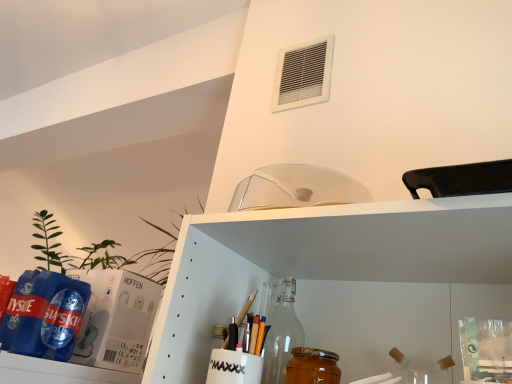
What do you see at coordinates (312, 367) in the screenshot? The image size is (512, 384). I see `golden honey jar at lower center` at bounding box center [312, 367].

Image resolution: width=512 pixels, height=384 pixels. Find the location of `golden honey jar at lower center`. golden honey jar at lower center is located at coordinates (312, 367).

Identify the location of white plastic air conditioning at upper center. (303, 75).

This screenshot has width=512, height=384. What do you see at coordinates (303, 75) in the screenshot?
I see `white plastic air conditioning at upper center` at bounding box center [303, 75].

Identify the location of golden honey jar at lower center. Image resolution: width=512 pixels, height=384 pixels. (312, 367).

Does golden honey jar at lower center appear on the right side of white plastic air conditioning at upper center?

In fact, golden honey jar at lower center is to the left of white plastic air conditioning at upper center.

Which is in front, golden honey jar at lower center or white plastic air conditioning at upper center?

golden honey jar at lower center is in front.

Considering the positions of points (302, 377) and (297, 59), is point (302, 377) farther from camera compared to point (297, 59)?

No, it is in front of (297, 59).

From the image's perspective, is golden honey jar at lower center beneath white plastic air conditioning at upper center?

Yes, from the image's perspective, golden honey jar at lower center is below white plastic air conditioning at upper center.

From a real-world perspective, is golden honey jar at lower center on white plastic air conditioning at upper center?

Incorrect, from a real-world perspective, golden honey jar at lower center is lower than white plastic air conditioning at upper center.

Considering the sizes of golden honey jar at lower center and white plastic air conditioning at upper center in the image, is golden honey jar at lower center wider or thinner than white plastic air conditioning at upper center?

golden honey jar at lower center is wider than white plastic air conditioning at upper center.

Does golden honey jar at lower center have a greater height compared to white plastic air conditioning at upper center?

No, golden honey jar at lower center is not taller than white plastic air conditioning at upper center.

Considering the relative sizes of golden honey jar at lower center and white plastic air conditioning at upper center in the image provided, is golden honey jar at lower center bigger than white plastic air conditioning at upper center?

No.

In the scene shown: Would you say golden honey jar at lower center is inside or outside white plastic air conditioning at upper center?

golden honey jar at lower center is outside white plastic air conditioning at upper center.

Is golden honey jar at lower center beside white plastic air conditioning at upper center?

golden honey jar at lower center and white plastic air conditioning at upper center are clearly separated.

Is golden honey jar at lower center oriented away from white plastic air conditioning at upper center?

No, golden honey jar at lower center is not facing away from white plastic air conditioning at upper center.

Where is `air conditioning located behind the golden honey jar at lower center`? air conditioning located behind the golden honey jar at lower center is located at coordinates pyautogui.click(x=303, y=75).

Considering the relative positions of white plastic air conditioning at upper center and golden honey jar at lower center in the image provided, is white plastic air conditioning at upper center to the left of golden honey jar at lower center from the viewer's perspective?

In fact, white plastic air conditioning at upper center is to the right of golden honey jar at lower center.

Which is in front, white plastic air conditioning at upper center or golden honey jar at lower center?

Positioned in front is golden honey jar at lower center.

Considering the positions of point (316, 101) and point (297, 352), is point (316, 101) closer or farther from the camera than point (297, 352)?

Point (316, 101) is farther from the camera than point (297, 352).

From the image's perspective, which is above, white plastic air conditioning at upper center or golden honey jar at lower center?

white plastic air conditioning at upper center, from the image's perspective.

From a real-world perspective, who is located higher, white plastic air conditioning at upper center or golden honey jar at lower center?

white plastic air conditioning at upper center.

Does white plastic air conditioning at upper center have a lesser width compared to golden honey jar at lower center?

Correct, the width of white plastic air conditioning at upper center is less than that of golden honey jar at lower center.

Is white plastic air conditioning at upper center taller than golden honey jar at lower center?

Yes.

Considering the relative sizes of white plastic air conditioning at upper center and golden honey jar at lower center in the image provided, is white plastic air conditioning at upper center smaller than golden honey jar at lower center?

No.

Which is correct: white plastic air conditioning at upper center is inside golden honey jar at lower center, or outside of it?

white plastic air conditioning at upper center is outside golden honey jar at lower center.

Are white plastic air conditioning at upper center and golden honey jar at lower center beside each other?

white plastic air conditioning at upper center and golden honey jar at lower center are not in contact.

From the picture: Could you tell me if white plastic air conditioning at upper center is facing golden honey jar at lower center?

No.

How many degrees apart are the facing directions of white plastic air conditioning at upper center and golden honey jar at lower center?

white plastic air conditioning at upper center and golden honey jar at lower center are facing 0.677 degrees away from each other.

The height and width of the screenshot is (384, 512). Identify the location of air conditioning above the golden honey jar at lower center (from the image's perspective). (303, 75).

Locate an element on the screen. The image size is (512, 384). air conditioning on the right of golden honey jar at lower center is located at coordinates (303, 75).

What are the coordinates of `beverage that appears in front of the white plastic air conditioning at upper center` in the screenshot? It's located at (312, 367).